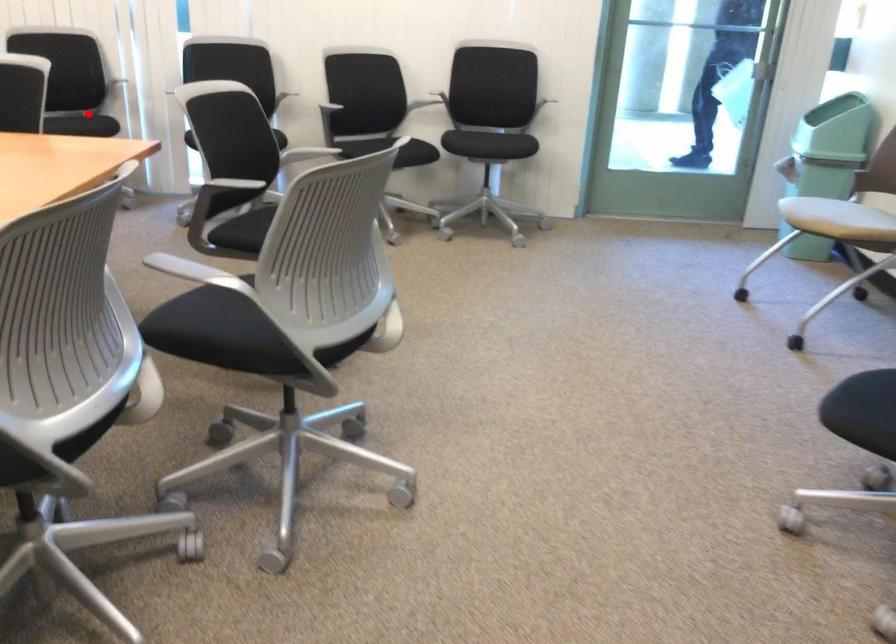
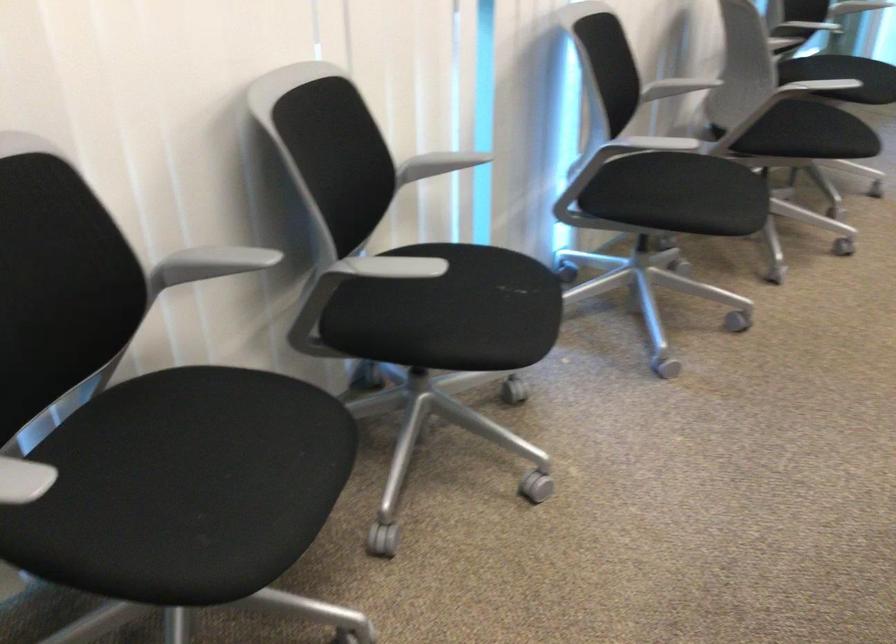
Question: I am providing you with two images of the same scene from different viewpoints. Image1 has a red point marked. In image2, the corresponding 3D location appears at what relative position? Reply with the corresponding letter.

Choices:
 (A) Closer
 (B) Farther

Answer: (A)